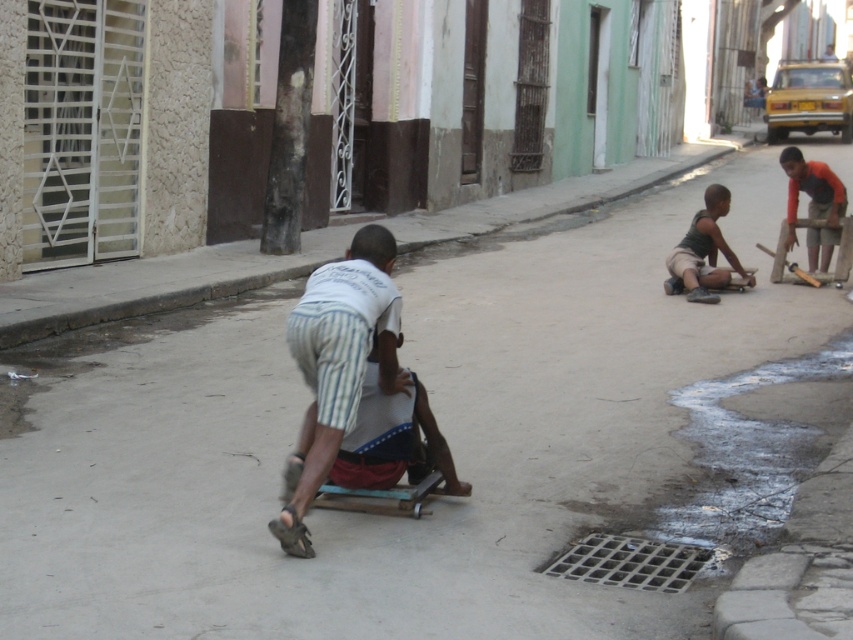
Question: Which of these objects is positioned farthest from the orange cotton shirt at right?

Choices:
 (A) striped cotton shorts at center
 (B) dark gray fabric shorts at right

Answer: (A)

Question: Does striped cotton shorts at center appear on the left side of dark gray fabric shorts at right?

Choices:
 (A) no
 (B) yes

Answer: (B)

Question: Which point is closer to the camera?

Choices:
 (A) (718, 186)
 (B) (813, 243)
 (C) (386, 321)

Answer: (C)

Question: Observing the image, what is the correct spatial positioning of striped cotton shorts at center in reference to dark gray fabric shorts at right?

Choices:
 (A) right
 (B) left

Answer: (B)

Question: Does striped cotton shorts at center appear over dark gray fabric shorts at right?

Choices:
 (A) no
 (B) yes

Answer: (A)

Question: Which point is farther to the camera?

Choices:
 (A) (352, 316)
 (B) (750, 280)
 (C) (791, 227)

Answer: (C)